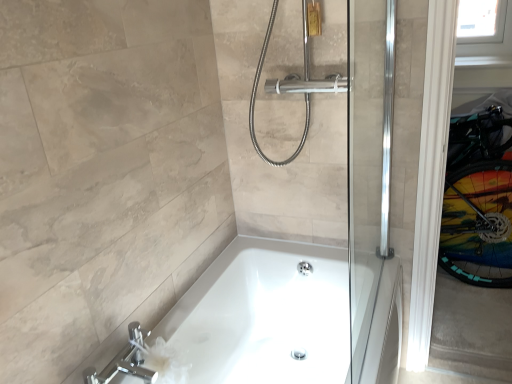
Question: From the image's perspective, is white glossy bathtub at center over chrome/metallic faucet at lower left?

Choices:
 (A) yes
 (B) no

Answer: (B)

Question: Is white glossy bathtub at center thinner than chrome/metallic faucet at lower left?

Choices:
 (A) no
 (B) yes

Answer: (A)

Question: Can you confirm if white glossy bathtub at center is taller than chrome/metallic faucet at lower left?

Choices:
 (A) no
 (B) yes

Answer: (B)

Question: Is white glossy bathtub at center far from chrome/metallic faucet at lower left?

Choices:
 (A) no
 (B) yes

Answer: (A)

Question: Does white glossy bathtub at center appear on the left side of chrome/metallic faucet at lower left?

Choices:
 (A) yes
 (B) no

Answer: (B)

Question: From the image's perspective, is white glossy bathtub at center under chrome/metallic faucet at lower left?

Choices:
 (A) no
 (B) yes

Answer: (B)

Question: Is the position of chrome/metallic faucet at lower left less distant than that of transparent plastic window screen at upper right?

Choices:
 (A) yes
 (B) no

Answer: (A)

Question: From the image's perspective, would you say chrome/metallic faucet at lower left is positioned over transparent plastic window screen at upper right?

Choices:
 (A) no
 (B) yes

Answer: (A)

Question: Is chrome/metallic faucet at lower left to the right of transparent plastic window screen at upper right from the viewer's perspective?

Choices:
 (A) yes
 (B) no

Answer: (B)

Question: Is chrome/metallic faucet at lower left aimed at transparent plastic window screen at upper right?

Choices:
 (A) yes
 (B) no

Answer: (B)

Question: Is chrome/metallic faucet at lower left far from transparent plastic window screen at upper right?

Choices:
 (A) yes
 (B) no

Answer: (A)

Question: Considering the relative sizes of chrome/metallic faucet at lower left and transparent plastic window screen at upper right in the image provided, is chrome/metallic faucet at lower left shorter than transparent plastic window screen at upper right?

Choices:
 (A) no
 (B) yes

Answer: (B)

Question: From the image's perspective, does transparent plastic window screen at upper right appear lower than white glossy bathtub at center?

Choices:
 (A) yes
 (B) no

Answer: (B)